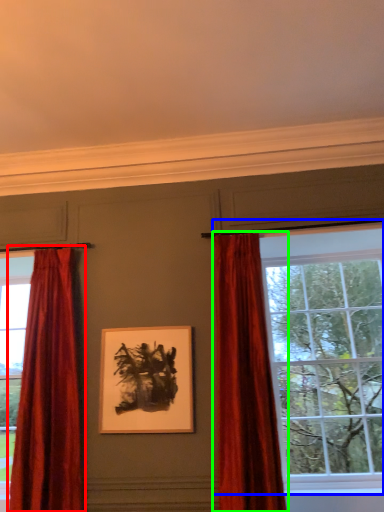
Question: Which is nearer to the curtain (highlighted by a red box)? window (highlighted by a blue box) or curtain (highlighted by a green box).

Choices:
 (A) window
 (B) curtain

Answer: (B)